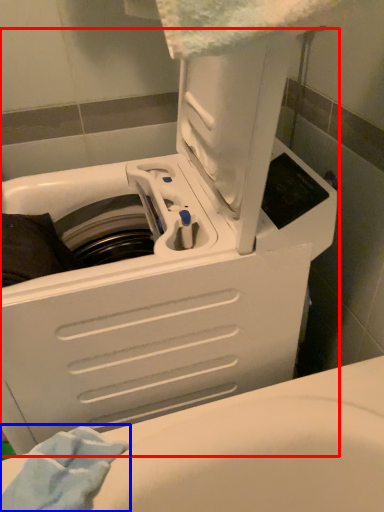
Question: Which point is closer to the camera, washing machine (highlighted by a red box) or bath towel (highlighted by a blue box)?

Choices:
 (A) washing machine
 (B) bath towel

Answer: (A)